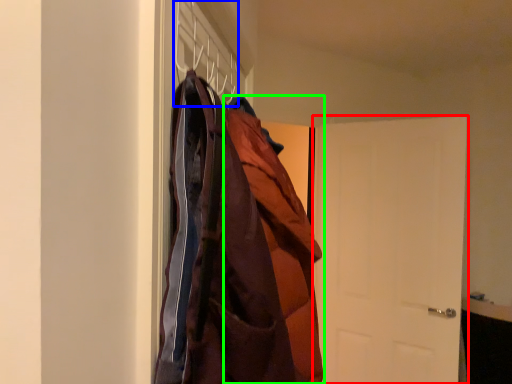
Question: Which object is positioned farthest from door (highlighted by a red box)? Select from hanger (highlighted by a blue box) and cloak (highlighted by a green box).

Choices:
 (A) hanger
 (B) cloak

Answer: (A)